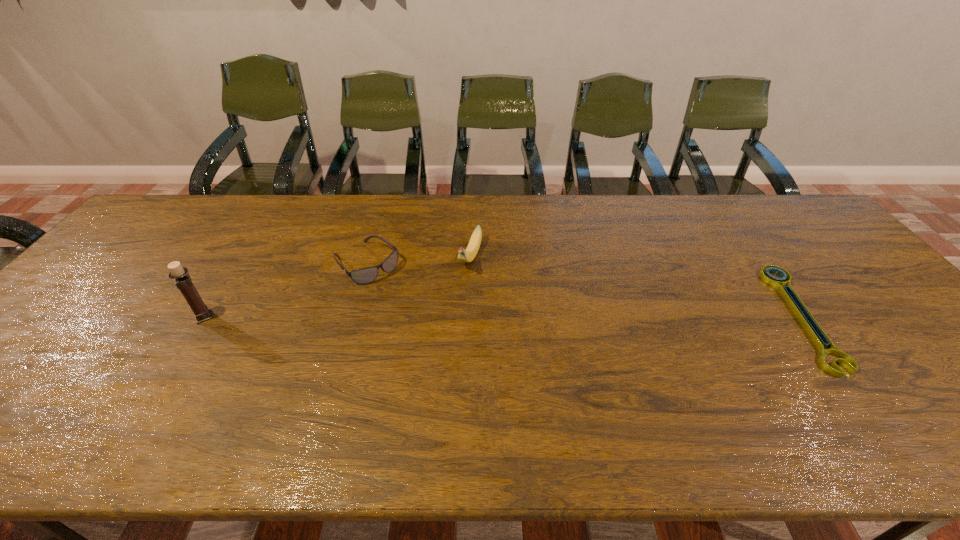
The image size is (960, 540). I want to click on vacant region between the shortest object and the banana, so click(x=636, y=287).

Locate an element on the screen. The width and height of the screenshot is (960, 540). empty space that is in between the leftmost object and the second shortest object is located at coordinates (285, 290).

Where is `object that stands as the third closest to the sunglasses`? object that stands as the third closest to the sunglasses is located at coordinates (816, 333).

Find the location of a particular element. The image size is (960, 540). object that is the second closest one to the leftmost object is located at coordinates (468, 255).